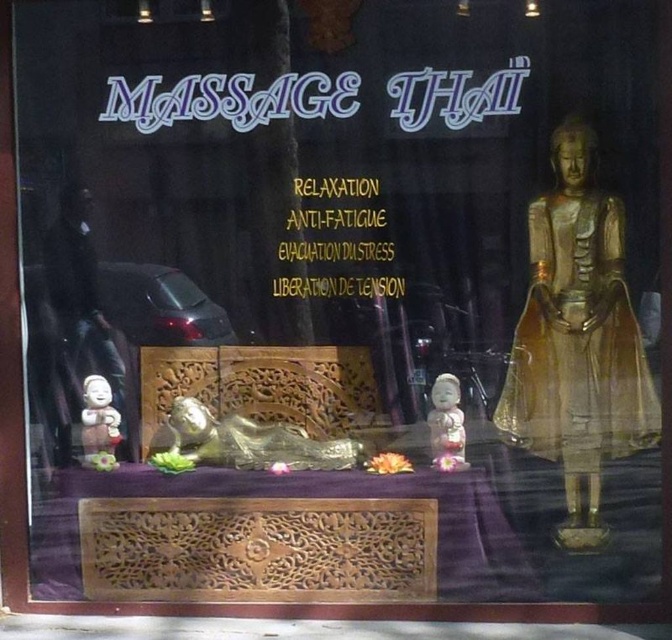
The width and height of the screenshot is (672, 640). Describe the element at coordinates (245, 442) in the screenshot. I see `gold metallic statue at center` at that location.

Looking at this image, can you confirm if gold metallic statue at center is taller than white porcelain figurine at center?

In fact, gold metallic statue at center may be shorter than white porcelain figurine at center.

This screenshot has height=640, width=672. Identify the location of gold metallic statue at center. (245, 442).

Locate an element on the screen. The image size is (672, 640). gold metallic statue at center is located at coordinates (245, 442).

Is gold metallic statue at center positioned behind white porcelain figurine at lower left?

That is False.

Is gold metallic statue at center positioned in front of white porcelain figurine at lower left?

That is True.

Is point (343, 456) behind point (120, 419)?

No, (343, 456) is in front of (120, 419).

This screenshot has width=672, height=640. Identify the location of gold metallic statue at center. (245, 442).

Which of these two, gold polished statue at right or white porcelain figurine at center, stands taller?

Standing taller between the two is gold polished statue at right.

Is gold polished statue at right bigger than white porcelain figurine at center?

Indeed, gold polished statue at right has a larger size compared to white porcelain figurine at center.

The image size is (672, 640). In order to click on gold polished statue at right in this screenshot , I will do `click(577, 339)`.

You are a GUI agent. You are given a task and a screenshot of the screen. Output one action in this format:
    pyautogui.click(x=<x>, y=<y>)
    Task: Click on the gold polished statue at right
    
    Given the screenshot: What is the action you would take?
    pyautogui.click(x=577, y=339)